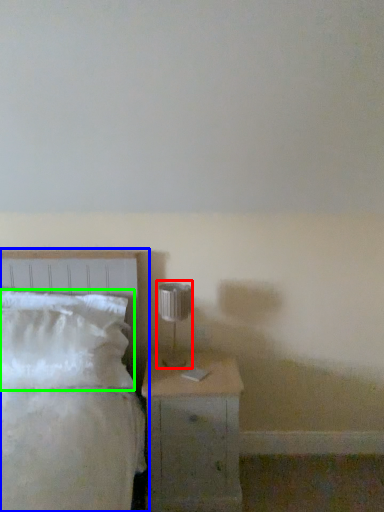
Question: Which is farther away from table lamp (highlighted by a red box)? bed (highlighted by a blue box) or pillow (highlighted by a green box)?

Choices:
 (A) bed
 (B) pillow

Answer: (B)